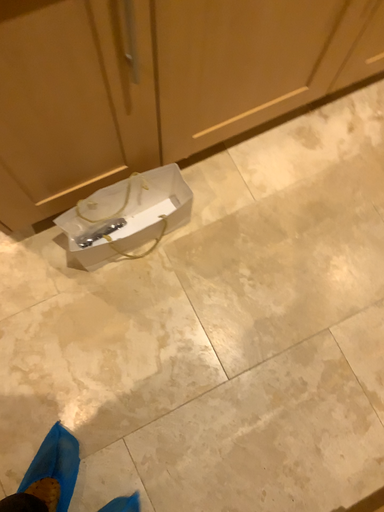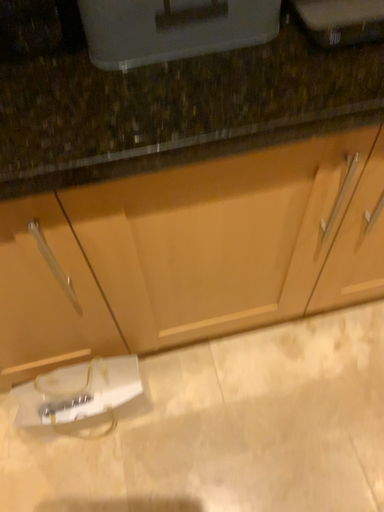
Question: How did the camera likely rotate when shooting the video?

Choices:
 (A) rotated downward
 (B) rotated upward

Answer: (B)